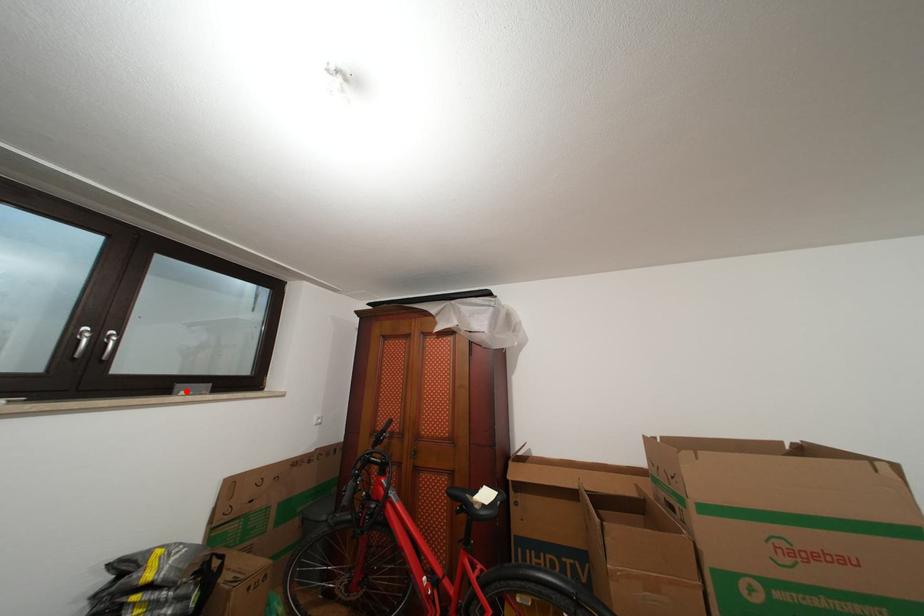
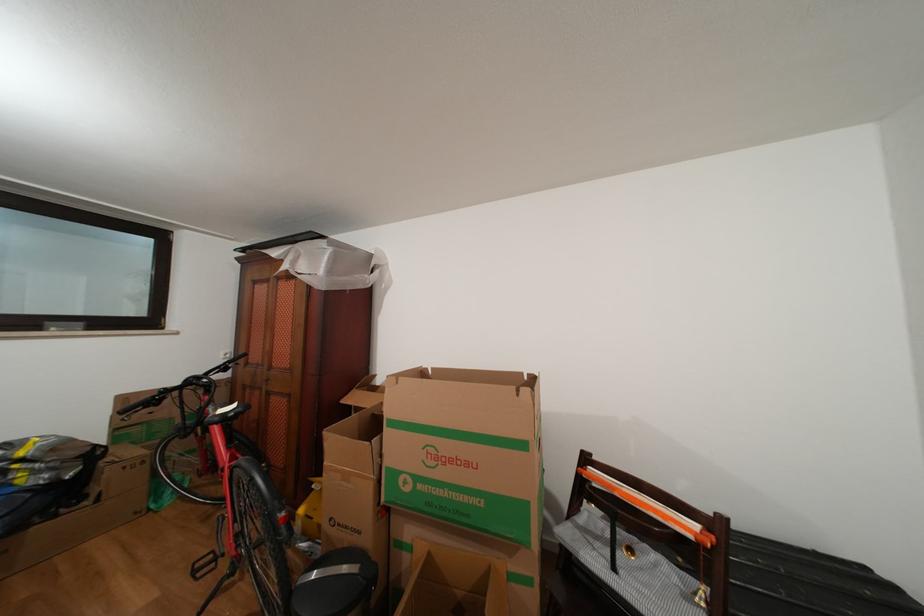
Locate, in the second image, the point that corresponds to the highlighted location in the first image.

(56, 329)